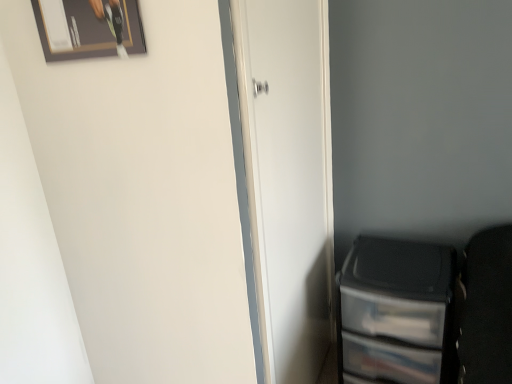
Question: Can we say wooden framed picture at upper left lies outside white matte door at center?

Choices:
 (A) no
 (B) yes

Answer: (B)

Question: From the image's perspective, is wooden framed picture at upper left located above white matte door at center?

Choices:
 (A) yes
 (B) no

Answer: (A)

Question: Is wooden framed picture at upper left at the right side of white matte door at center?

Choices:
 (A) yes
 (B) no

Answer: (B)

Question: Can you confirm if wooden framed picture at upper left is wider than white matte door at center?

Choices:
 (A) no
 (B) yes

Answer: (A)

Question: Does wooden framed picture at upper left have a lesser height compared to white matte door at center?

Choices:
 (A) yes
 (B) no

Answer: (A)

Question: From a real-world perspective, is wooden framed picture at upper left physically below white matte door at center?

Choices:
 (A) yes
 (B) no

Answer: (B)

Question: Is transparent plastic file cabinet at lower right positioned beyond the bounds of white matte door at center?

Choices:
 (A) yes
 (B) no

Answer: (A)

Question: Considering the relative sizes of transparent plastic file cabinet at lower right and white matte door at center in the image provided, is transparent plastic file cabinet at lower right thinner than white matte door at center?

Choices:
 (A) yes
 (B) no

Answer: (B)

Question: From a real-world perspective, does transparent plastic file cabinet at lower right stand above white matte door at center?

Choices:
 (A) no
 (B) yes

Answer: (A)

Question: Is transparent plastic file cabinet at lower right shorter than white matte door at center?

Choices:
 (A) no
 (B) yes

Answer: (B)

Question: Would you say transparent plastic file cabinet at lower right is a long distance from white matte door at center?

Choices:
 (A) no
 (B) yes

Answer: (A)

Question: Is transparent plastic file cabinet at lower right aimed at white matte door at center?

Choices:
 (A) no
 (B) yes

Answer: (A)

Question: From the image's perspective, is transparent plastic file cabinet at lower right on top of wooden framed picture at upper left?

Choices:
 (A) no
 (B) yes

Answer: (A)